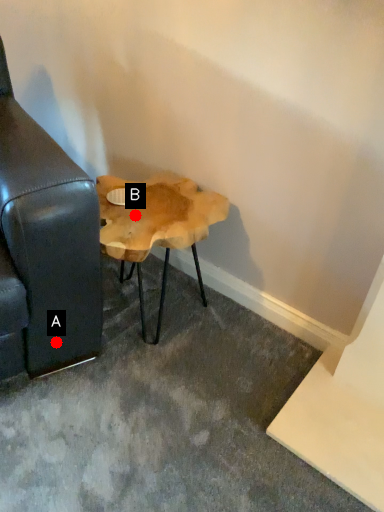
Question: Two points are circled on the image, labeled by A and B beside each circle. Which of the following is the closest to the observer?

Choices:
 (A) A is closer
 (B) B is closer

Answer: (A)